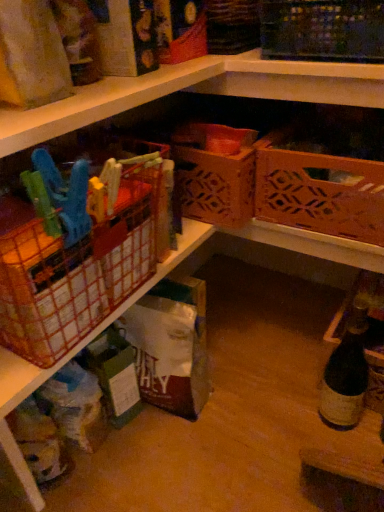
Question: From a real-world perspective, is brown cardboard box at center over wooden lattice basket at upper right, positioned as the first basket in right-to-left order?

Choices:
 (A) yes
 (B) no

Answer: (B)

Question: Does brown cardboard box at center lie in front of wooden lattice basket at upper right, the third basket viewed from the left?

Choices:
 (A) no
 (B) yes

Answer: (A)

Question: From a real-world perspective, is brown cardboard box at center physically below wooden lattice basket at upper right, positioned as the first basket in right-to-left order?

Choices:
 (A) yes
 (B) no

Answer: (A)

Question: Does brown cardboard box at center have a lesser height compared to wooden lattice basket at upper right, the third basket viewed from the left?

Choices:
 (A) yes
 (B) no

Answer: (B)

Question: Would you say brown cardboard box at center is outside wooden lattice basket at upper right, the third basket viewed from the left?

Choices:
 (A) yes
 (B) no

Answer: (A)

Question: Could you tell me if brown cardboard box at center is turned towards wooden lattice basket at upper right, positioned as the first basket in right-to-left order?

Choices:
 (A) no
 (B) yes

Answer: (A)

Question: Considering the relative sizes of dark brown glass bottle at lower right and brown cardboard box at center in the image provided, is dark brown glass bottle at lower right shorter than brown cardboard box at center?

Choices:
 (A) no
 (B) yes

Answer: (A)

Question: Would you consider dark brown glass bottle at lower right to be distant from brown cardboard box at center?

Choices:
 (A) no
 (B) yes

Answer: (A)

Question: Considering the relative positions of dark brown glass bottle at lower right and brown cardboard box at center in the image provided, is dark brown glass bottle at lower right behind brown cardboard box at center?

Choices:
 (A) yes
 (B) no

Answer: (B)

Question: Can you confirm if dark brown glass bottle at lower right is positioned to the left of brown cardboard box at center?

Choices:
 (A) yes
 (B) no

Answer: (B)

Question: Is dark brown glass bottle at lower right thinner than brown cardboard box at center?

Choices:
 (A) no
 (B) yes

Answer: (B)

Question: From the image's perspective, would you say dark brown glass bottle at lower right is shown under brown cardboard box at center?

Choices:
 (A) no
 (B) yes

Answer: (B)

Question: Does orange plastic basket at left, the 3th basket in the right-to-left sequence, have a greater height compared to brown cardboard box at center?

Choices:
 (A) yes
 (B) no

Answer: (B)